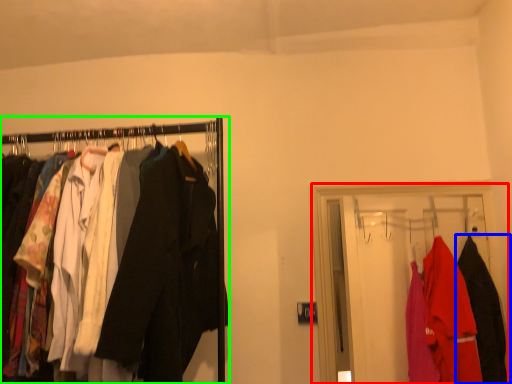
Question: Considering the real-world distances, which object is farthest from closet (highlighted by a red box)? fancy dress (highlighted by a blue box) or closet (highlighted by a green box)?

Choices:
 (A) fancy dress
 (B) closet

Answer: (B)